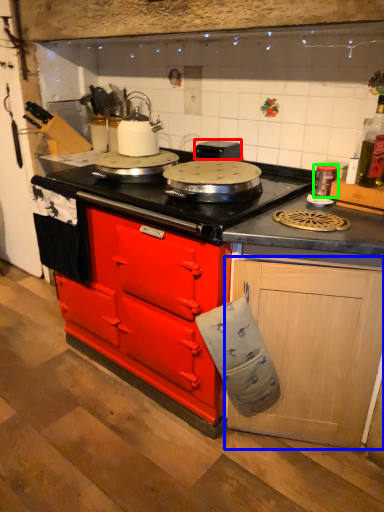
Question: Which object is positioned closest to appliance (highlighted by a red box)? Select from cabinetry (highlighted by a blue box) and kitchen appliance (highlighted by a green box).

Choices:
 (A) cabinetry
 (B) kitchen appliance

Answer: (B)